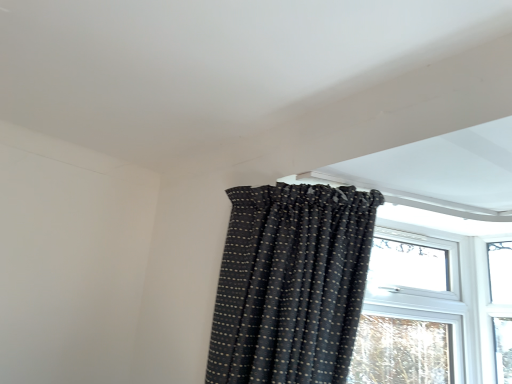
What is the approximate width of transparent glass window at upper right?

transparent glass window at upper right is 8.37 centimeters wide.

The width and height of the screenshot is (512, 384). I want to click on transparent glass window at upper right, so click(x=429, y=305).

In order to face transparent glass window at upper right, should I rotate leftwards or rightwards?

To align with it, rotate right about 20.493°.

The height and width of the screenshot is (384, 512). What do you see at coordinates (429, 305) in the screenshot? I see `transparent glass window at upper right` at bounding box center [429, 305].

The image size is (512, 384). Identify the location of transparent glass window at upper right. (429, 305).